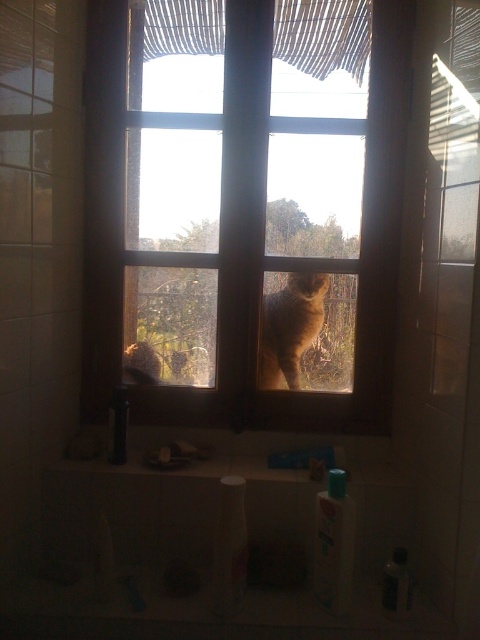
Is wooden frame at center positioned in front of fuzzy brown cat at center?

That is True.

Does wooden frame at center have a larger size compared to fuzzy brown cat at center?

Indeed, wooden frame at center has a larger size compared to fuzzy brown cat at center.

Is point (157, 8) positioned in front of point (292, 362)?

Yes, point (157, 8) is in front of point (292, 362).

The image size is (480, 640). In order to click on wooden frame at center in this screenshot , I will do `click(242, 209)`.

Between point (393, 236) and point (180, 33), which one is positioned in front?

Point (180, 33) is in front.

Is point (165, 406) positioned behind point (216, 10)?

Yes.

This screenshot has height=640, width=480. In order to click on wooden frame at center in this screenshot , I will do [x=242, y=209].

Which is behind, point (290, 8) or point (264, 371)?

The point (264, 371) is behind.

Is white woven curtain at upper center positioned before fuzzy brown cat at center?

That is True.

You are a GUI agent. You are given a task and a screenshot of the screen. Output one action in this format:
    pyautogui.click(x=<x>, y=<y>)
    Task: Click on the white woven curtain at upper center
    This screenshot has height=640, width=480.
    Given the screenshot: What is the action you would take?
    pyautogui.click(x=324, y=35)